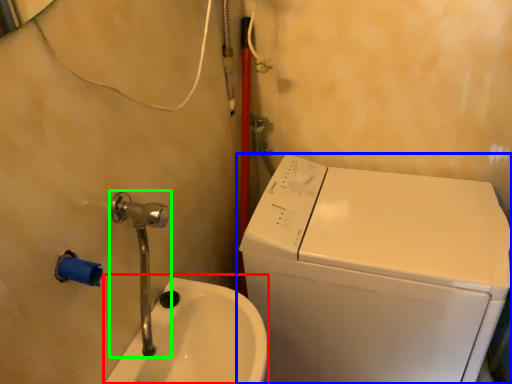
Question: Which object is positioned closest to sink (highlighted by a red box)? Select from washing machine (highlighted by a blue box) and plumbing fixture (highlighted by a green box).

Choices:
 (A) washing machine
 (B) plumbing fixture

Answer: (B)